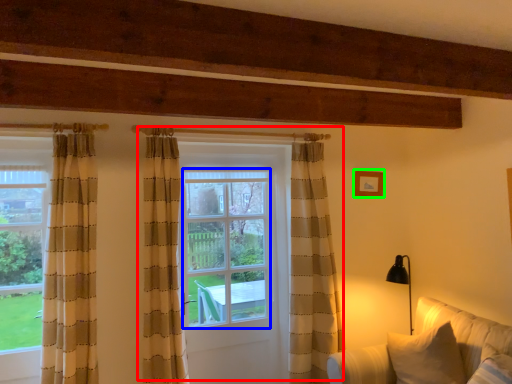
Question: Estimate the real-world distances between objects in this image. Which object is farther from door (highlighted by a red box), window screen (highlighted by a blue box) or picture frame (highlighted by a green box)?

Choices:
 (A) window screen
 (B) picture frame

Answer: (B)